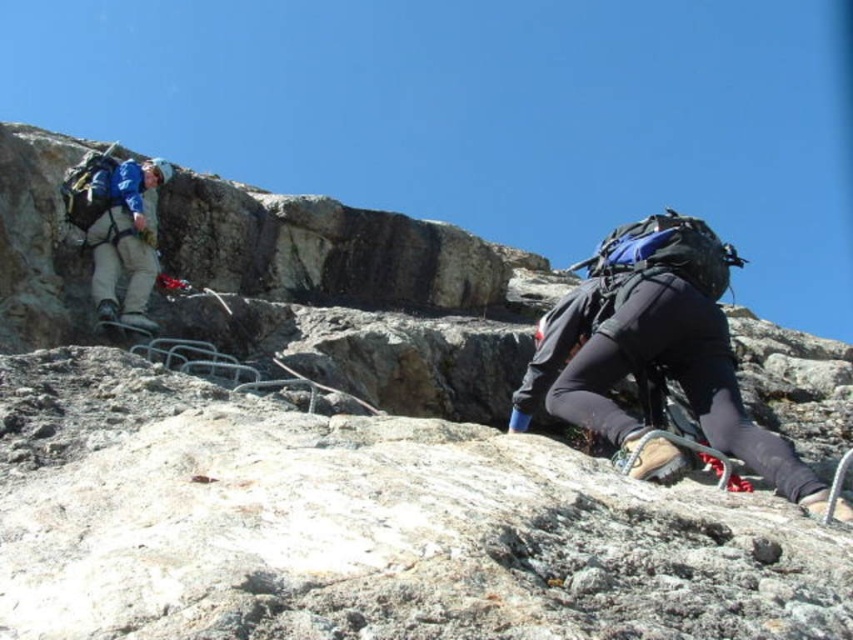
Is matte black backpack at lower right to the left of blue fabric jacket at upper left from the viewer's perspective?

No, matte black backpack at lower right is not to the left of blue fabric jacket at upper left.

Does point (698, 358) lie in front of point (167, 170)?

Yes, it is in front of point (167, 170).

Is point (634, 241) in front of point (93, 224)?

Yes, point (634, 241) is in front of point (93, 224).

Identify the location of matte black backpack at lower right. The width and height of the screenshot is (853, 640). tap(654, 353).